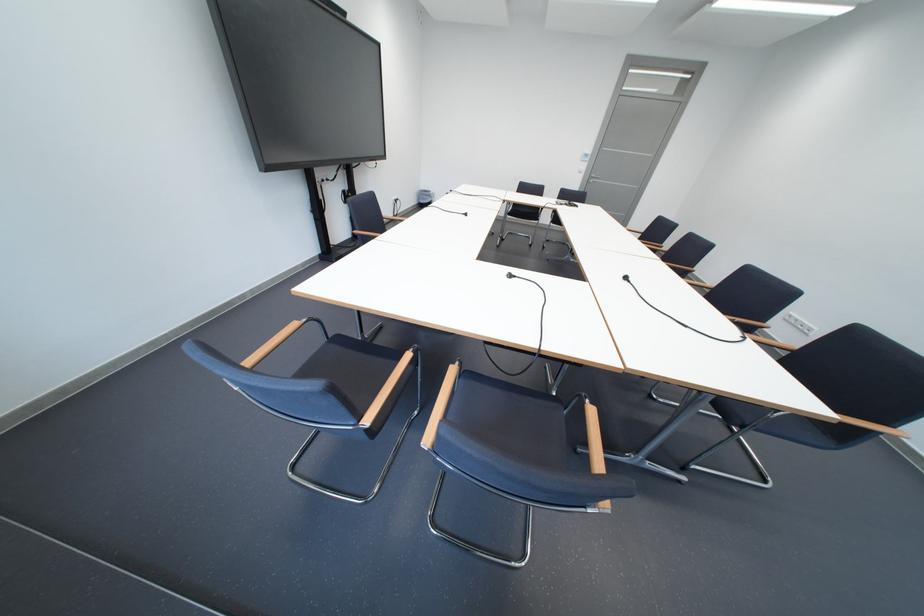
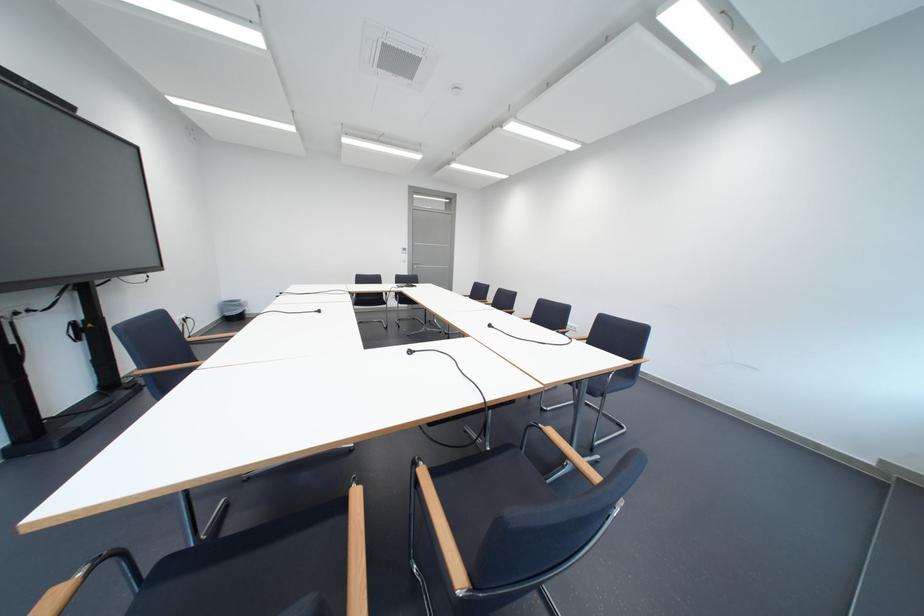
The point at (350,342) is marked in the first image. Where is the corresponding point in the second image?

(178, 572)